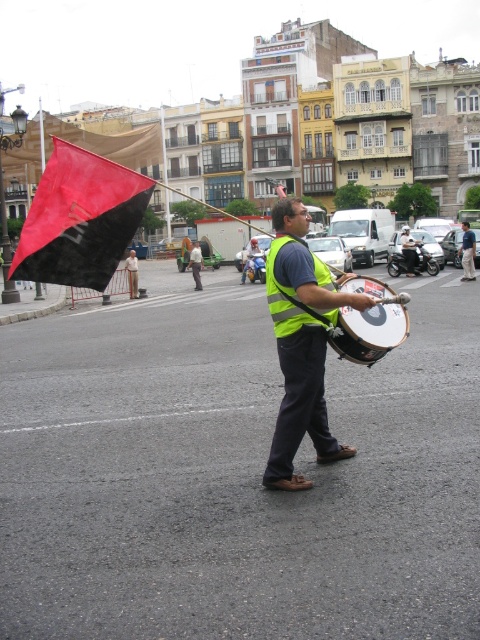
You are a pedestrian crossing the street and notice the matte black drum at center and the reflective yellow safety vest at center. Which object is more to the right?

The matte black drum at center is positioned on the right side of reflective yellow safety vest at center, so it is more to the right.

You are a pedestrian trying to cross the street and see a man holding a matte black drum at center and wearing dark blue jeans at center. Which object is closer to the left side of the image?

The matte black drum at center is to the left of dark blue jeans at center, so the matte black drum at center is closer to the left side of the image.

You are a pedestrian trying to cross the road and see the matte black drum at center and the reflective yellow safety vest at center. Which object is closer to your eye level?

The reflective yellow safety vest at center is closer to your eye level because it is taller than the matte black drum at center.